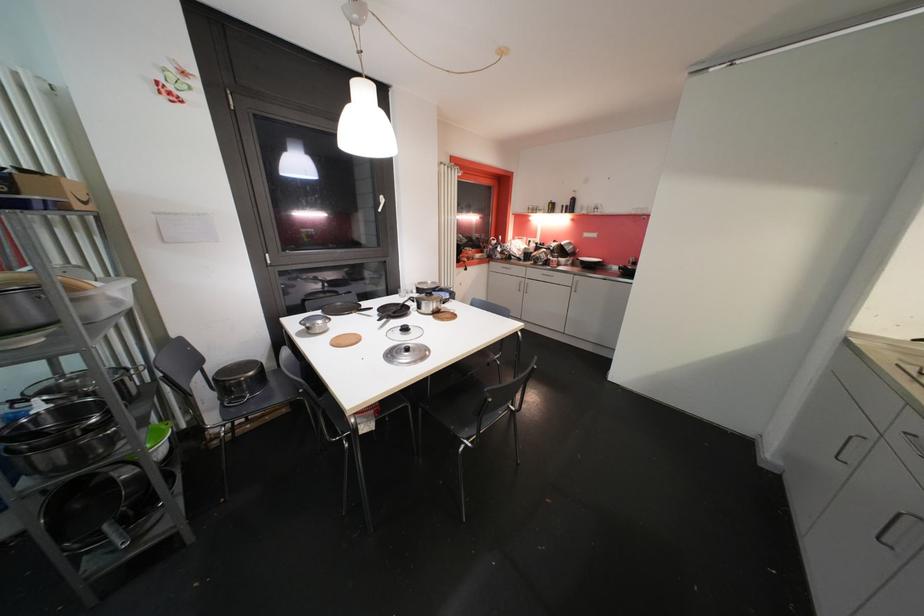
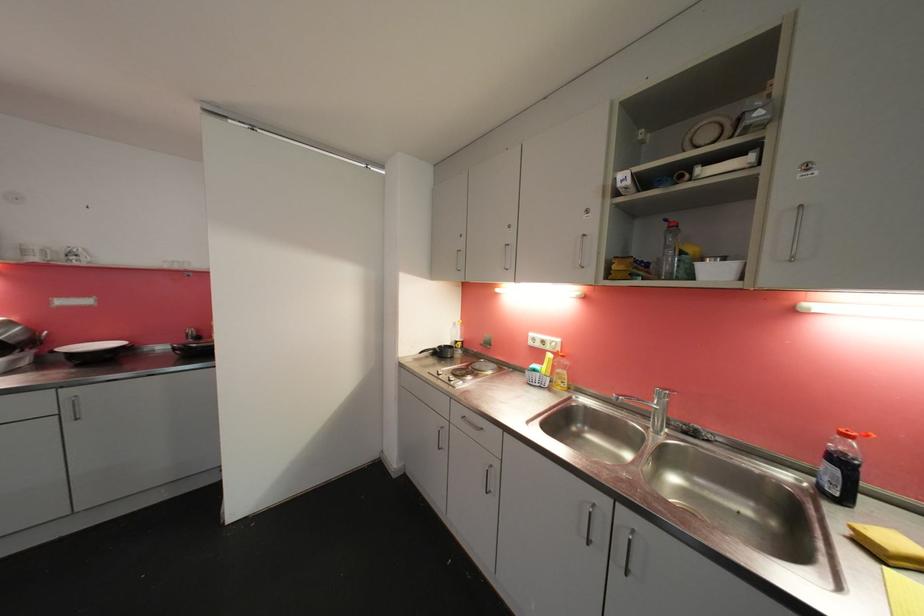
Question: The camera is either moving clockwise (left) or counter-clockwise (right) around the object. The first image is from the beginning of the video and the second image is from the end. Is the camera moving left or right when shooting the video?

Choices:
 (A) Left
 (B) Right

Answer: (A)